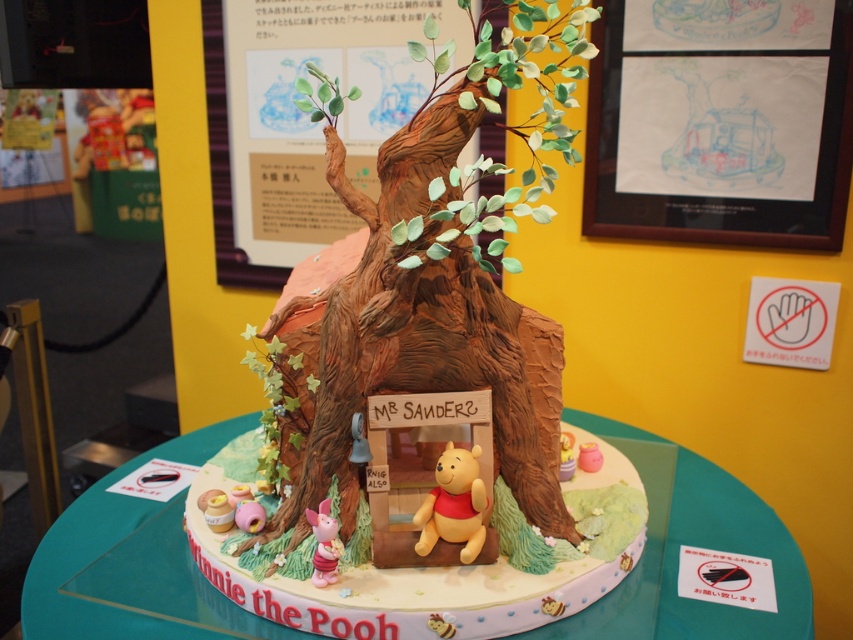
Who is more forward, (90, 609) or (431, 529)?

Point (431, 529) is more forward.

From the picture: Does smooth teal cake at center have a larger size compared to yellow matte winnie the pooh at center?

Yes, smooth teal cake at center is bigger than yellow matte winnie the pooh at center.

Describe the element at coordinates (729, 548) in the screenshot. I see `smooth teal cake at center` at that location.

Locate an element on the screen. This screenshot has width=853, height=640. smooth teal cake at center is located at coordinates (729, 548).

I want to click on matte brown treehouse at center, so coord(428,387).

From the picture: Is matte brown treehouse at center below yellow matte winnie the pooh at center?

Actually, matte brown treehouse at center is above yellow matte winnie the pooh at center.

What do you see at coordinates (428, 387) in the screenshot? I see `matte brown treehouse at center` at bounding box center [428, 387].

Identify the location of matte brown treehouse at center. (428, 387).

From the picture: Which of these two, matte brown treehouse at center or matte brown bear at center, stands taller?

With more height is matte brown treehouse at center.

Is point (490, 531) behind point (560, 452)?

No, (490, 531) is in front of (560, 452).

I want to click on matte brown treehouse at center, so click(428, 387).